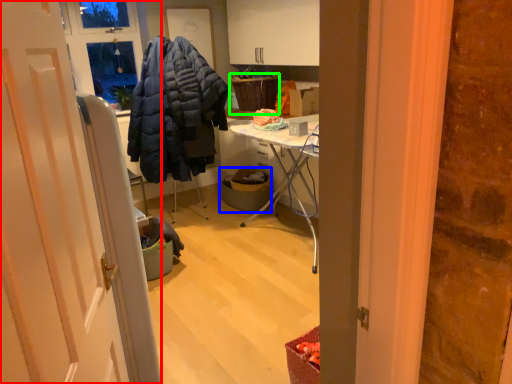
Question: Estimate the real-world distances between objects in this image. Which object is farther from door (highlighted by a red box), trash bin/can (highlighted by a blue box) or picnic basket (highlighted by a green box)?

Choices:
 (A) trash bin/can
 (B) picnic basket

Answer: (B)